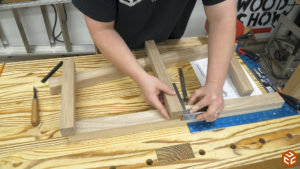
Where is `marker`? The image size is (300, 169). marker is located at coordinates (54, 69).